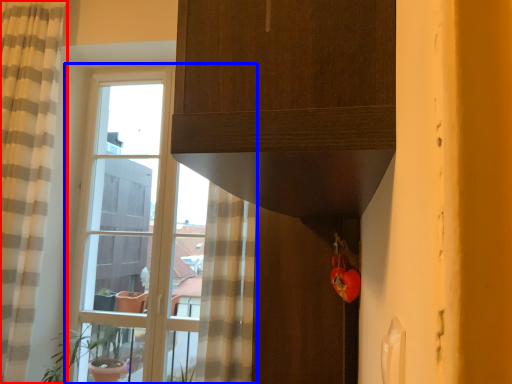
Question: Which point is further to the camera, curtain (highlighted by a red box) or window (highlighted by a blue box)?

Choices:
 (A) curtain
 (B) window

Answer: (B)